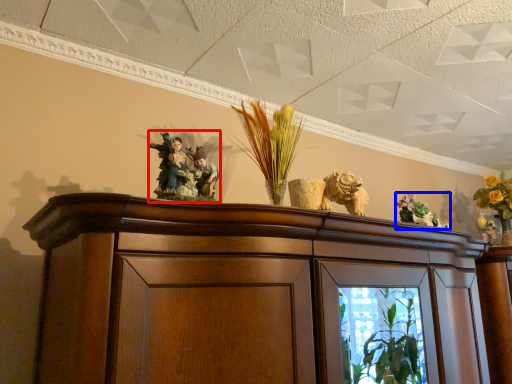
Question: Which point is further to the camera, collection (highlighted by a red box) or floral arrangement (highlighted by a blue box)?

Choices:
 (A) collection
 (B) floral arrangement

Answer: (B)